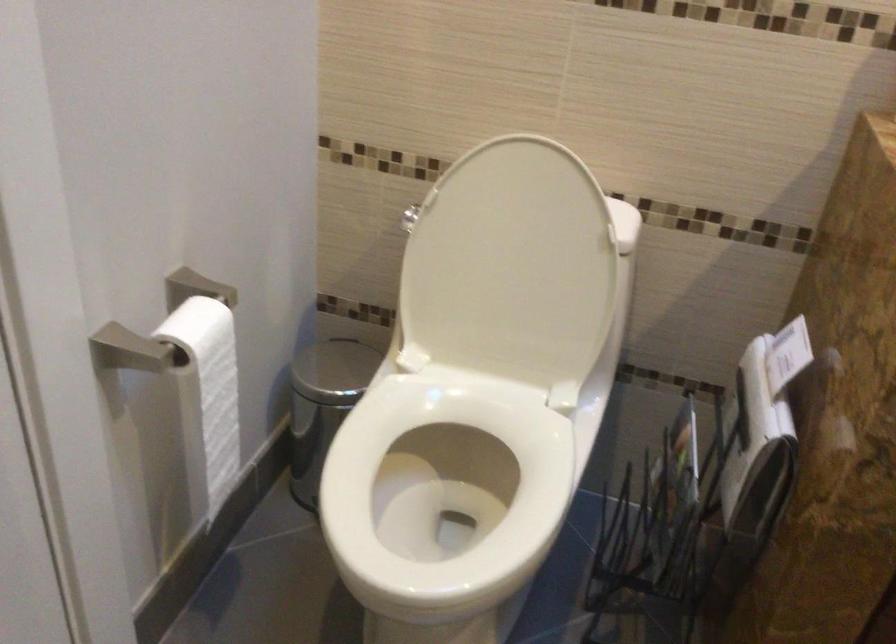
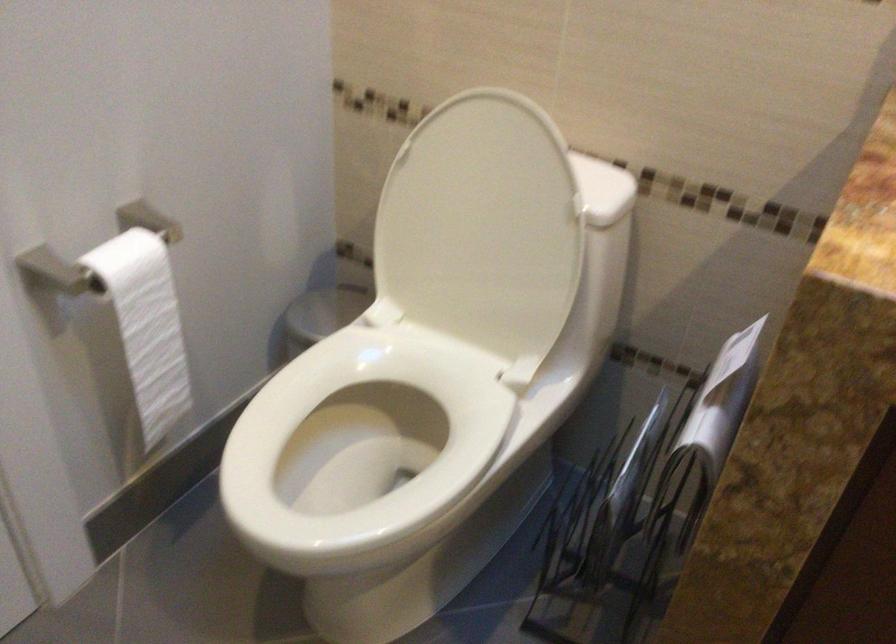
Where in the second image is the point corresponding to the point at 216,393 from the first image?

(147, 325)